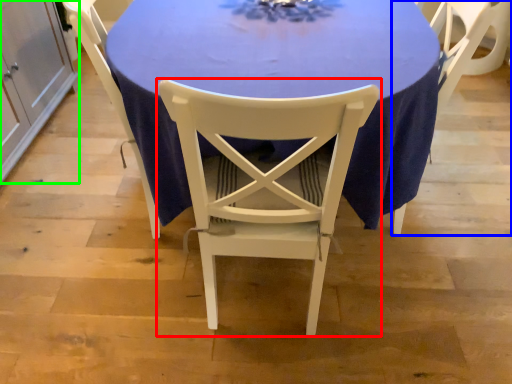
Question: Based on their relative distances, which object is nearer to chair (highlighted by a red box)? Choose from chair (highlighted by a blue box) and cabinetry (highlighted by a green box).

Choices:
 (A) chair
 (B) cabinetry

Answer: (A)